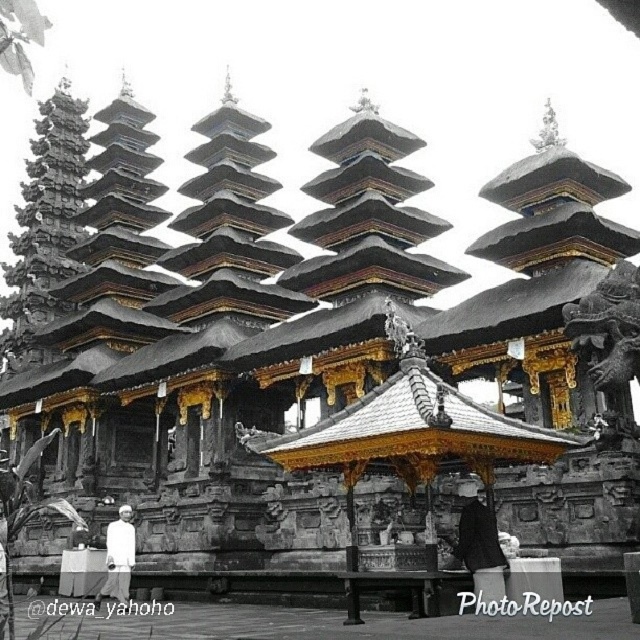
Question: Does dark gray fabric coat at center have a lesser width compared to white cloth at lower left?

Choices:
 (A) no
 (B) yes

Answer: (B)

Question: Which of the following is the closest to the observer?

Choices:
 (A) (460, 538)
 (B) (116, 548)

Answer: (A)

Question: Which of the following is the farthest from the observer?

Choices:
 (A) (120, 604)
 (B) (484, 518)

Answer: (A)

Question: Does dark gray fabric coat at center appear under white cloth at lower left?

Choices:
 (A) no
 (B) yes

Answer: (A)

Question: Which object appears closest to the camera in this image?

Choices:
 (A) white cloth at lower left
 (B) dark gray fabric coat at center

Answer: (B)

Question: From the image, what is the correct spatial relationship of dark gray fabric coat at center in relation to white cloth at lower left?

Choices:
 (A) left
 (B) right

Answer: (B)